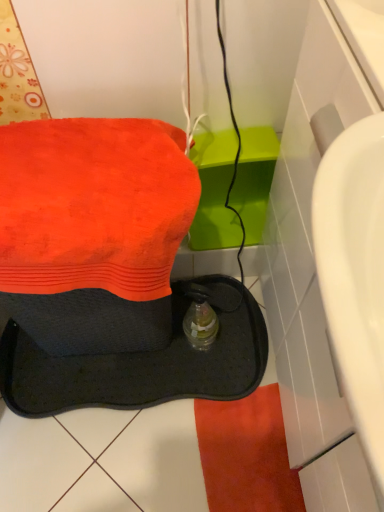
The image size is (384, 512). In order to click on free space above black rubber sink at lower left (from a real-world perspective) in this screenshot , I will do `click(93, 169)`.